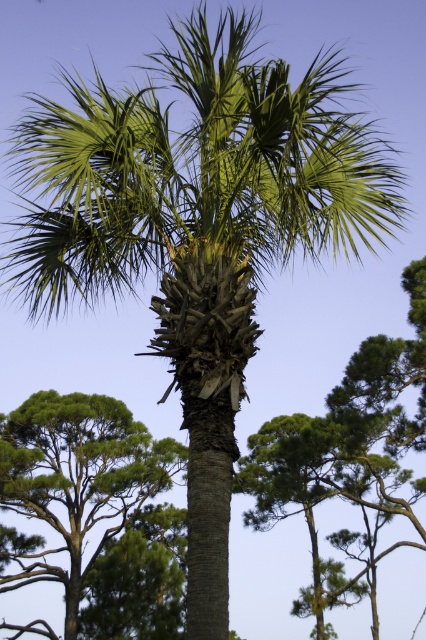
Question: Which point is closer to the camera?

Choices:
 (A) (58, 518)
 (B) (368, 408)

Answer: (B)

Question: Which point is farther to the camera?

Choices:
 (A) (399, 348)
 (B) (85, 520)

Answer: (B)

Question: Which object appears closest to the camera in this image?

Choices:
 (A) green leafy tree at lower left
 (B) green leafy palm at center

Answer: (B)

Question: Does green leafy palm at center come in front of green leafy tree at lower left?

Choices:
 (A) yes
 (B) no

Answer: (A)

Question: Does green leafy palm at center lie in front of green leafy tree at lower left?

Choices:
 (A) yes
 (B) no

Answer: (A)

Question: Can you confirm if green leafy palm at center is smaller than green leafy tree at lower left?

Choices:
 (A) no
 (B) yes

Answer: (A)